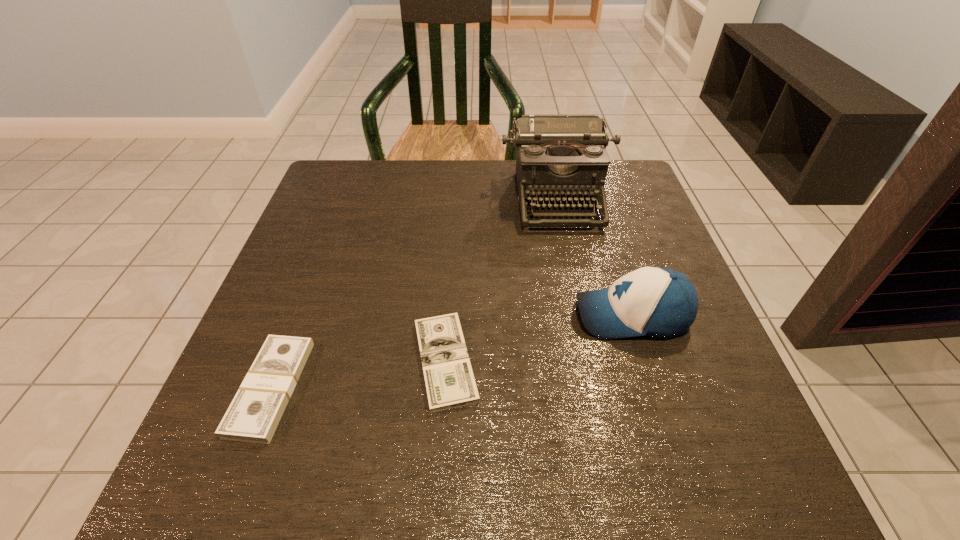
Where is `typewriter`? This screenshot has width=960, height=540. typewriter is located at coordinates (558, 156).

I want to click on the farthest object, so click(558, 156).

Locate an element on the screen. The height and width of the screenshot is (540, 960). the second tallest object is located at coordinates (651, 301).

Identify the location of the taller dollar. (253, 416).

This screenshot has height=540, width=960. Find the location of `the leftmost object`. the leftmost object is located at coordinates tap(253, 416).

The width and height of the screenshot is (960, 540). In order to click on the right dollar in this screenshot , I will do `click(449, 379)`.

Where is `the shortest object`? the shortest object is located at coordinates (449, 379).

Locate an element on the screen. This screenshot has width=960, height=540. vacant space located on the typing side of the farthest object is located at coordinates (568, 252).

At what (x,y) coordinates should I click in order to perform the action: click on vacant space situated on the front-facing side of the baseball cap. Please return your answer as a coordinate pair (x, y). Looking at the image, I should click on (466, 315).

This screenshot has width=960, height=540. Identify the location of vacant space located on the front-facing side of the baseball cap. (507, 315).